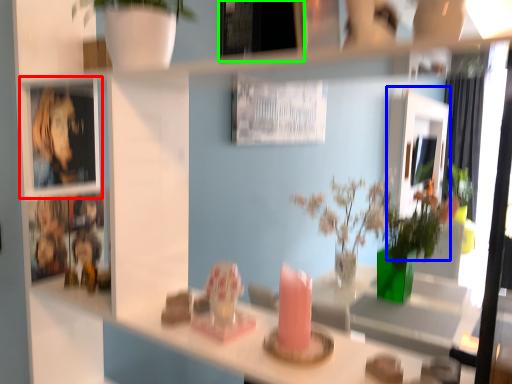
Question: Which object is the closest to the cabinet (highlighted by a red box)? Choose among these: mirror (highlighted by a blue box) or picture frame (highlighted by a green box).

Choices:
 (A) mirror
 (B) picture frame

Answer: (B)